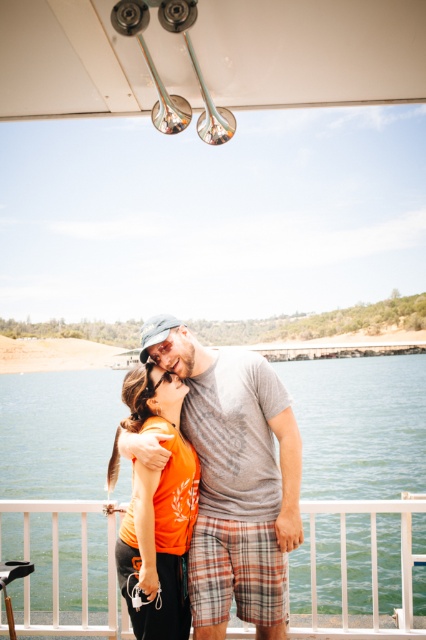
What is located at the coordinates point (359, 424) in the image?

The coordinates point (359, 424) corresponds to transparent water at center.